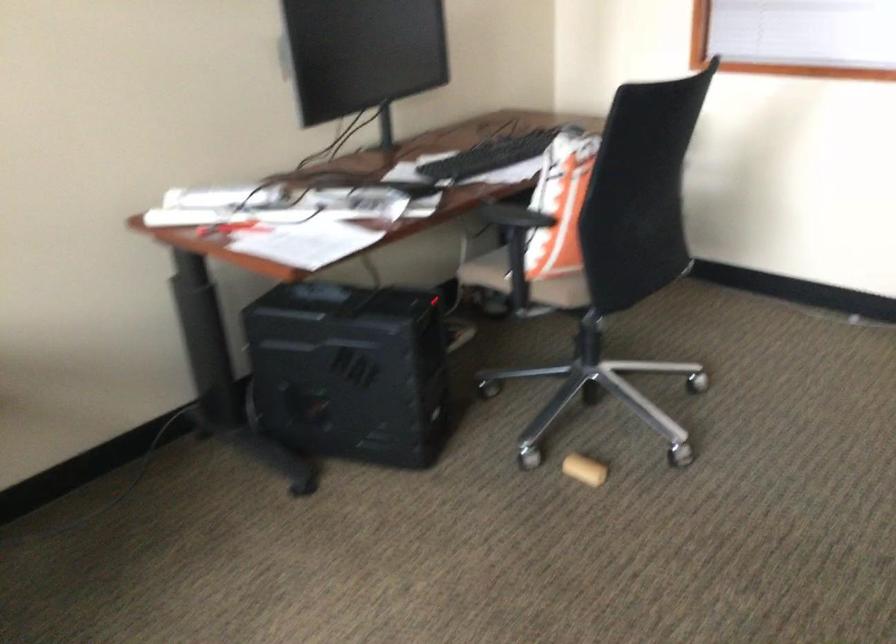
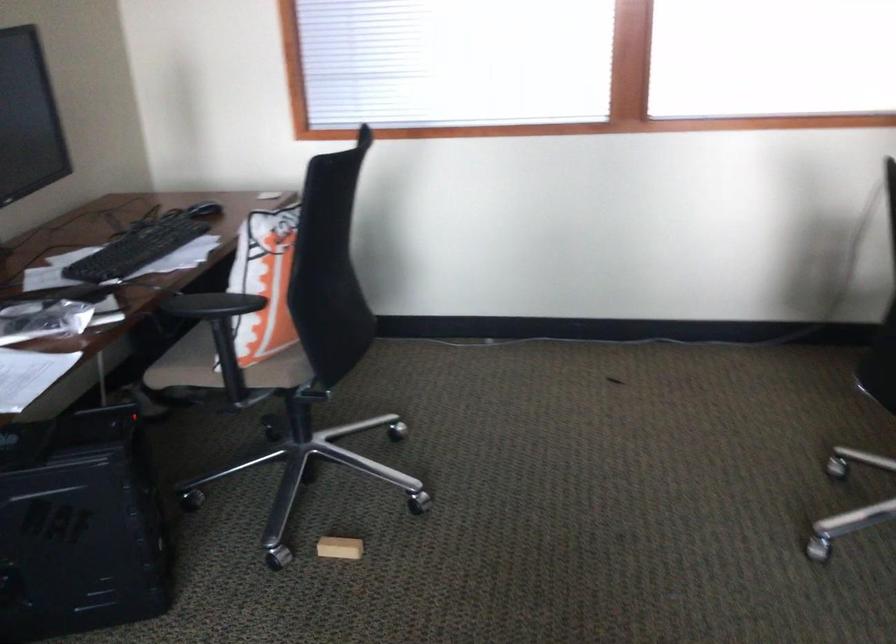
Where in the second image is the point corresponding to (x=477, y=158) from the first image?

(138, 248)